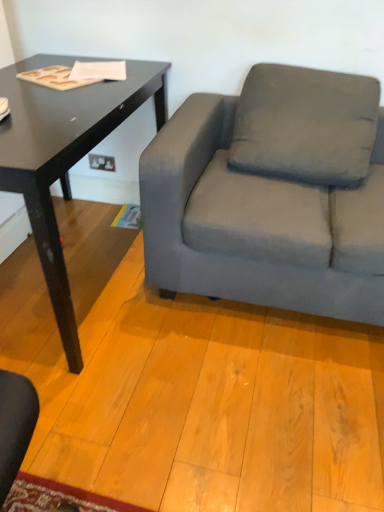
Question: Based on their sizes in the image, would you say black glossy table at left is bigger or smaller than gray fabric pillow at center?

Choices:
 (A) small
 (B) big

Answer: (B)

Question: From the image's perspective, relative to gray fabric pillow at center, is black glossy table at left above or below?

Choices:
 (A) below
 (B) above

Answer: (A)

Question: Based on their relative distances, which object is nearer to the black glossy table at left?

Choices:
 (A) gray fabric pillow at center
 (B) gray fabric couch at right

Answer: (B)

Question: Estimate the real-world distances between objects in this image. Which object is farther from the gray fabric pillow at center?

Choices:
 (A) black glossy table at left
 (B) gray fabric couch at right

Answer: (A)